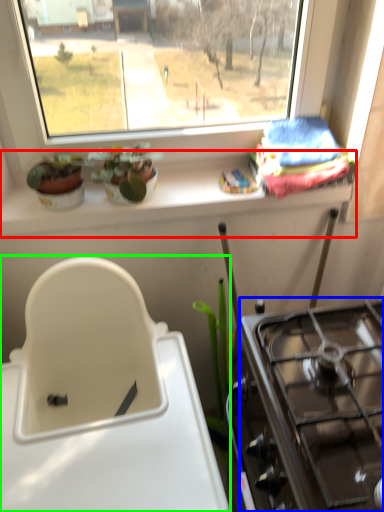
Question: Which object is the closest to the window sill (highlighted by a red box)? Choose among these: gas stove (highlighted by a blue box) or sink (highlighted by a green box).

Choices:
 (A) gas stove
 (B) sink

Answer: (B)